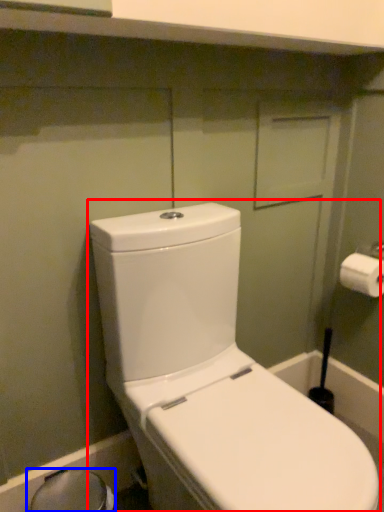
Question: Among these objects, which one is farthest to the camera, toilet (highlighted by a red box) or bidet (highlighted by a blue box)?

Choices:
 (A) toilet
 (B) bidet

Answer: (B)